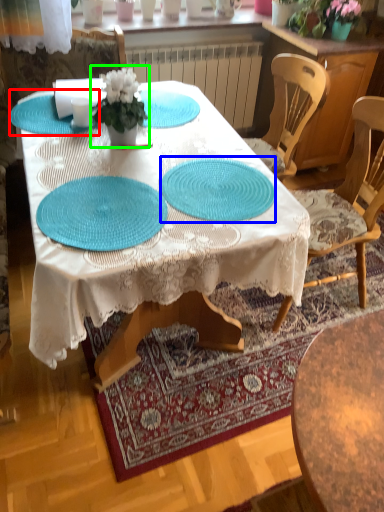
Question: Which object is the closest to the glass plate (highlighted by a red box)? Choose among these: glass plate (highlighted by a blue box) or houseplant (highlighted by a green box).

Choices:
 (A) glass plate
 (B) houseplant

Answer: (B)